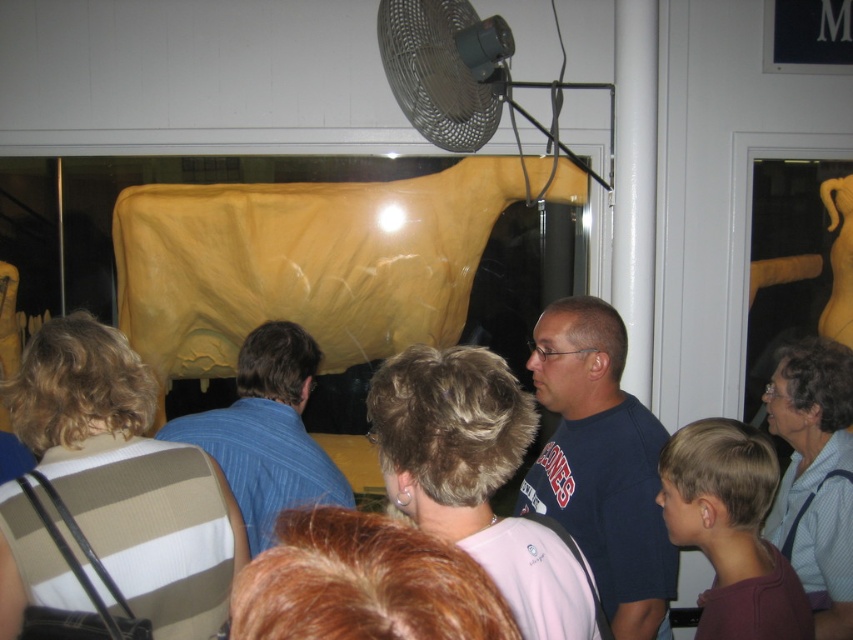
Question: Which point appears farthest from the camera in this image?

Choices:
 (A) (480, 67)
 (B) (589, 417)
 (C) (102, 440)

Answer: (B)

Question: Which object is farther from the camera taking this photo?

Choices:
 (A) blue striped shirt at center
 (B) black mesh fan at upper center

Answer: (A)

Question: Does brown striped shirt at center appear over black mesh fan at upper center?

Choices:
 (A) yes
 (B) no

Answer: (B)

Question: In this image, where is dark blue t-shirt at center located relative to black mesh fan at upper center?

Choices:
 (A) above
 (B) below

Answer: (B)

Question: Considering the real-world distances, which object is farthest from the dark blue t-shirt at center?

Choices:
 (A) brown striped shirt at center
 (B) black mesh fan at upper center

Answer: (A)

Question: Does blue striped shirt at center appear over black mesh fan at upper center?

Choices:
 (A) yes
 (B) no

Answer: (B)